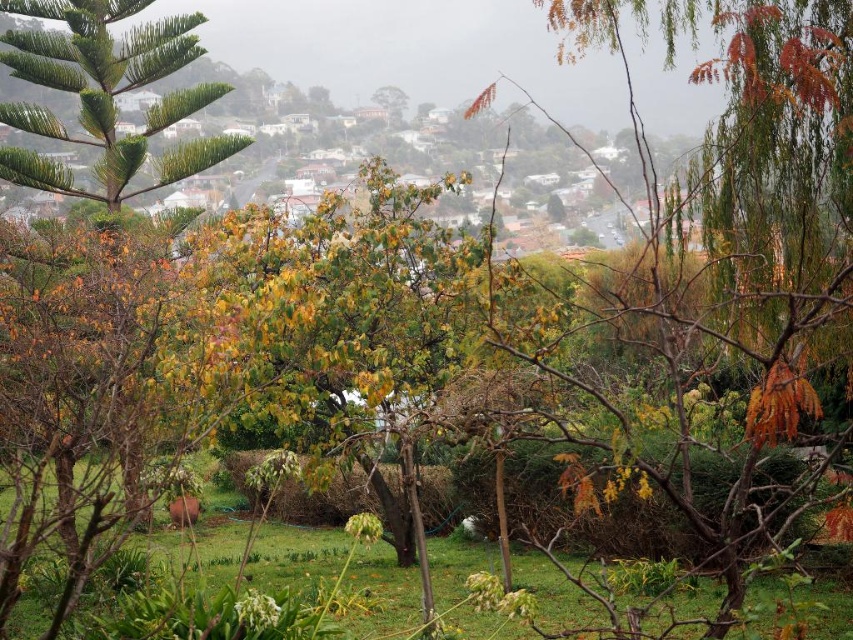
Question: Considering the relative positions of green grass at center and green leafy tree at upper center in the image provided, where is green grass at center located with respect to green leafy tree at upper center?

Choices:
 (A) left
 (B) right

Answer: (B)

Question: Is green grass at center above green leafy tree at upper center?

Choices:
 (A) no
 (B) yes

Answer: (A)

Question: Among these objects, which one is farthest from the camera?

Choices:
 (A) green leafy tree at upper center
 (B) green grass at center

Answer: (A)

Question: Among these points, which one is nearest to the camera?

Choices:
 (A) (397, 115)
 (B) (833, 609)

Answer: (B)

Question: Can you confirm if green grass at center is bigger than green leafy tree at upper center?

Choices:
 (A) no
 (B) yes

Answer: (B)

Question: Which object is farther from the camera taking this photo?

Choices:
 (A) green leafy tree at upper center
 (B) green grass at center

Answer: (A)